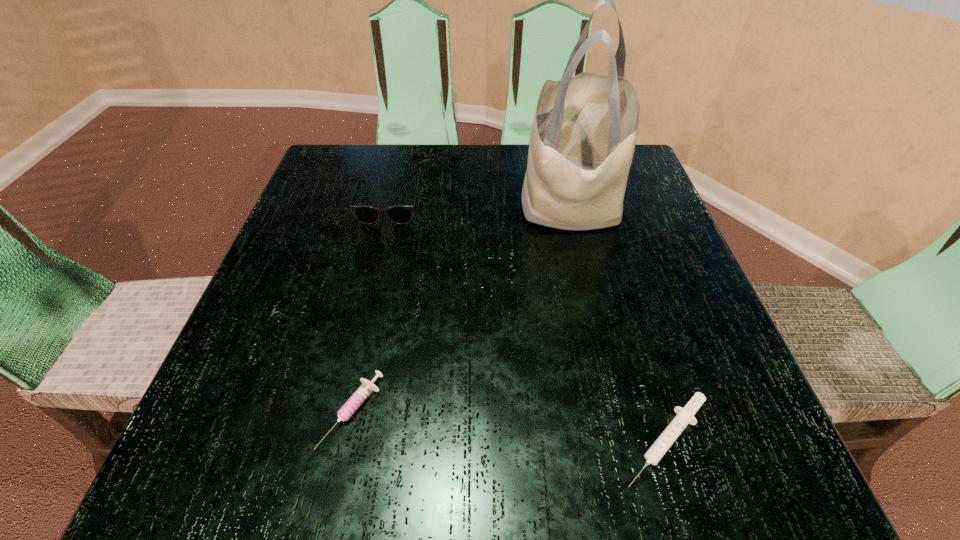
Locate an element on the screen. The height and width of the screenshot is (540, 960). vacant space at the far left corner of the desktop is located at coordinates (312, 180).

At what (x,y) coordinates should I click in order to perform the action: click on blank region between the right syringe and the left syringe. Please return your answer as a coordinate pair (x, y). Looking at the image, I should click on (510, 426).

Locate an element on the screen. This screenshot has width=960, height=540. free point between the shopping bag and the left syringe is located at coordinates (462, 305).

Locate an element on the screen. This screenshot has height=540, width=960. vacant region between the tallest object and the sunglasses is located at coordinates (481, 201).

I want to click on vacant space in between the sunglasses and the right syringe, so click(528, 322).

In order to click on empty location between the left syringe and the second tallest object in this screenshot , I will do `click(372, 308)`.

The image size is (960, 540). Find the location of `unoccupied position between the shopping bag and the left syringe`. unoccupied position between the shopping bag and the left syringe is located at coordinates (462, 305).

Where is `free space between the shopping bag and the left syringe`? The height and width of the screenshot is (540, 960). free space between the shopping bag and the left syringe is located at coordinates (462, 305).

In order to click on free space between the right syringe and the second tallest object in this screenshot , I will do `click(528, 322)`.

You are a GUI agent. You are given a task and a screenshot of the screen. Output one action in this format:
    pyautogui.click(x=<x>, y=<y>)
    Task: Click on the free spot between the left syringe and the tallest object
    The width and height of the screenshot is (960, 540).
    Given the screenshot: What is the action you would take?
    pyautogui.click(x=462, y=305)